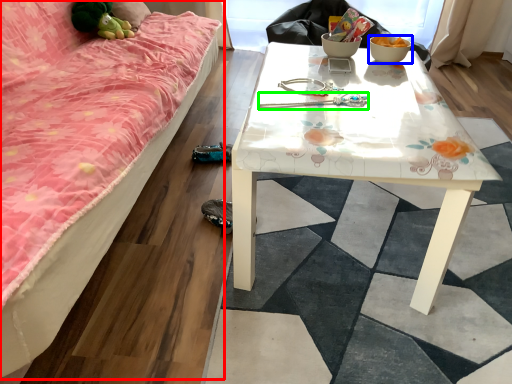
Question: Which is nearer to the studio couch (highlighted by a red box)? bowl (highlighted by a blue box) or twin (highlighted by a green box).

Choices:
 (A) bowl
 (B) twin

Answer: (B)